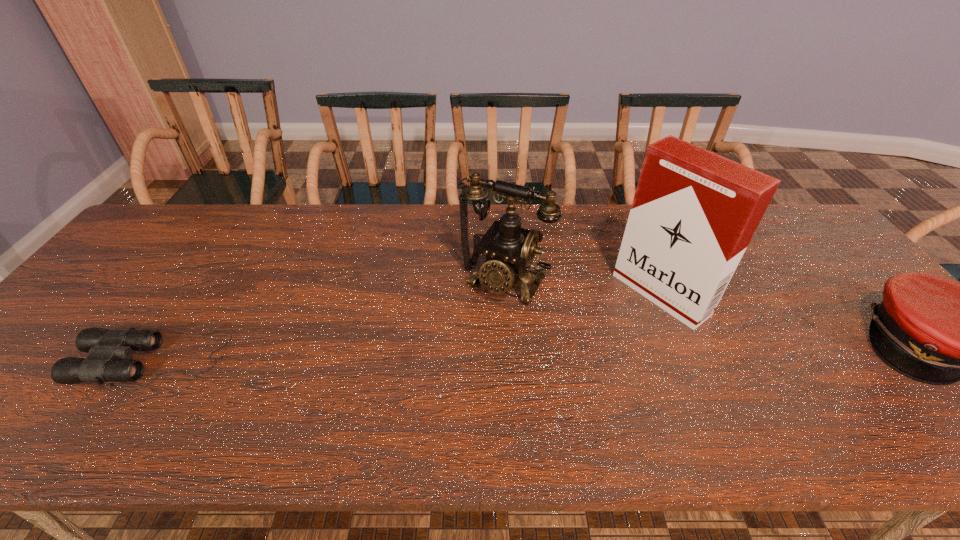
You are a GUI agent. You are given a task and a screenshot of the screen. Output one action in this format:
    pyautogui.click(x=<x>, y=<y>)
    Task: Click on the free space between the cigarette_case and the shortest object
    The width and height of the screenshot is (960, 540).
    Given the screenshot: What is the action you would take?
    pyautogui.click(x=408, y=327)

Point out which object is positioned as the second nearest to the shortest object. Please provide its 2D coordinates. Your answer should be formatted as a tuple, i.e. [(x, y)], where the tuple contains the x and y coordinates of a point satisfying the conditions above.

[(694, 212)]

At what (x,y) coordinates should I click in order to perform the action: click on object that stands as the second closest to the telephone. Please return your answer as a coordinate pair (x, y). The image size is (960, 540). Looking at the image, I should click on (106, 347).